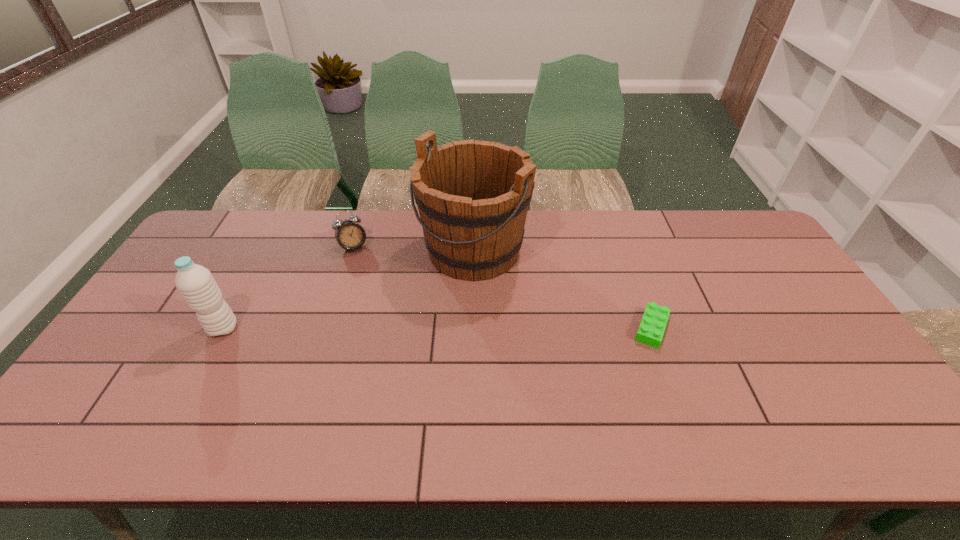
This screenshot has height=540, width=960. I want to click on free space located on the face of the third tallest object, so click(x=366, y=272).

This screenshot has height=540, width=960. What are the coordinates of `free space located 0.330m on the face of the third tallest object` in the screenshot? It's located at (392, 325).

Find the location of a particular element. vacant space situated on the face of the third tallest object is located at coordinates (368, 276).

Where is `vacant area located on the side of the second object from right to left with the handle for carrying`? The width and height of the screenshot is (960, 540). vacant area located on the side of the second object from right to left with the handle for carrying is located at coordinates pyautogui.click(x=403, y=316).

This screenshot has height=540, width=960. I want to click on free spot located on the side of the second object from right to left with the handle for carrying, so click(x=403, y=316).

The image size is (960, 540). What are the coordinates of `free location located on the side of the second object from right to left with the handle for carrying` in the screenshot? It's located at (408, 311).

Where is `alarm clock at the far edge`? Image resolution: width=960 pixels, height=540 pixels. alarm clock at the far edge is located at coordinates (350, 235).

Where is `wine bucket that is at the far edge`? The image size is (960, 540). wine bucket that is at the far edge is located at coordinates (473, 196).

Where is `vacant region at the far edge of the desktop`? The image size is (960, 540). vacant region at the far edge of the desktop is located at coordinates (424, 248).

Where is `vacant space at the near edge of the desktop`? This screenshot has width=960, height=540. vacant space at the near edge of the desktop is located at coordinates (329, 394).